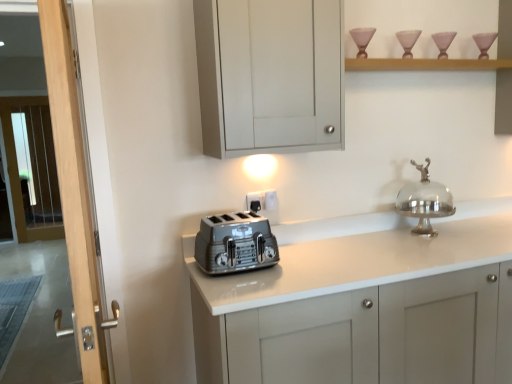
Question: From a real-world perspective, is white plastic electric outlet at center, marked as the 2th electric outlet in a left-to-right arrangement, physically located above or below satin silver toaster at center?

Choices:
 (A) above
 (B) below

Answer: (A)

Question: From the image's perspective, relative to satin silver toaster at center, is white plastic electric outlet at center, marked as the 1th electric outlet in a right-to-left arrangement, above or below?

Choices:
 (A) below
 (B) above

Answer: (B)

Question: Which object is the closest to the white glossy countertop at center?

Choices:
 (A) satin silver toaster at center
 (B) wooden shelf at upper center
 (C) matte gray cabinet at upper center
 (D) wooden screen door at left, arranged as the first screen door when viewed from the front
 (E) matte black outlet at center, the second electric outlet when ordered from right to left

Answer: (A)

Question: Which of these objects is positioned farthest from the satin silver toaster at center?

Choices:
 (A) wooden shelf at upper center
 (B) clear glass screen door at left, the second screen door when ordered from right to left
 (C) matte gray cabinet at upper center
 (D) white glossy countertop at center
 (E) silver metallic cake stand at upper right

Answer: (B)